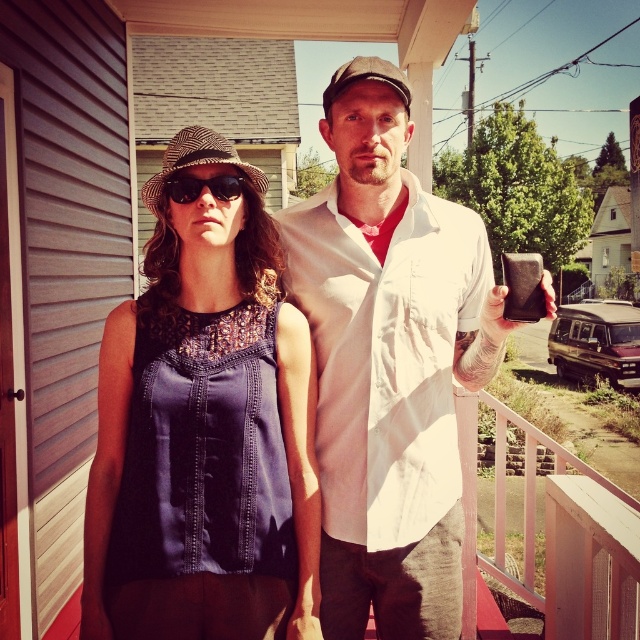
Which is more to the right, white cotton shirt at center or black textured sunglasses at center?

Positioned to the right is white cotton shirt at center.

Does white cotton shirt at center have a larger size compared to black textured sunglasses at center?

Correct, white cotton shirt at center is larger in size than black textured sunglasses at center.

At what (x,y) coordinates should I click in order to perform the action: click on white cotton shirt at center. Please return your answer as a coordinate pair (x, y). The width and height of the screenshot is (640, 640). Looking at the image, I should click on (388, 362).

The image size is (640, 640). I want to click on matte blue dress at center, so click(x=204, y=428).

Is matte blue dress at center taller than white cotton shirt at center?

In fact, matte blue dress at center may be shorter than white cotton shirt at center.

Between point (259, 573) and point (381, 212), which one is positioned in front?

Point (259, 573) is in front.

Find the location of a particular element. This screenshot has height=640, width=640. matte blue dress at center is located at coordinates (204, 428).

Can you confirm if matte blue dress at center is shorter than black textured sunglasses at center?

No.

Does matte blue dress at center lie in front of black textured sunglasses at center?

Yes.

Which is in front, point (120, 492) or point (182, 173)?

Point (182, 173) is in front.

Find the location of `matte blue dress at center`. matte blue dress at center is located at coordinates (204, 428).